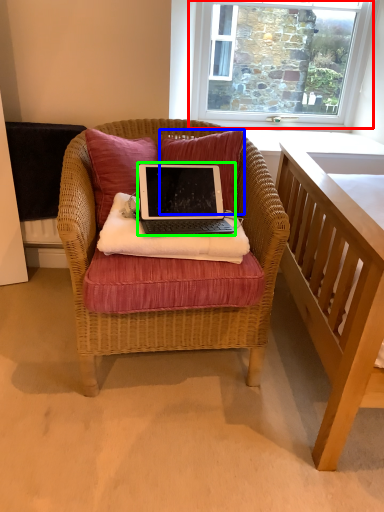
Question: Which object is the closest to the window (highlighted by a red box)? Choose among these: pillow (highlighted by a blue box) or laptop (highlighted by a green box).

Choices:
 (A) pillow
 (B) laptop

Answer: (A)